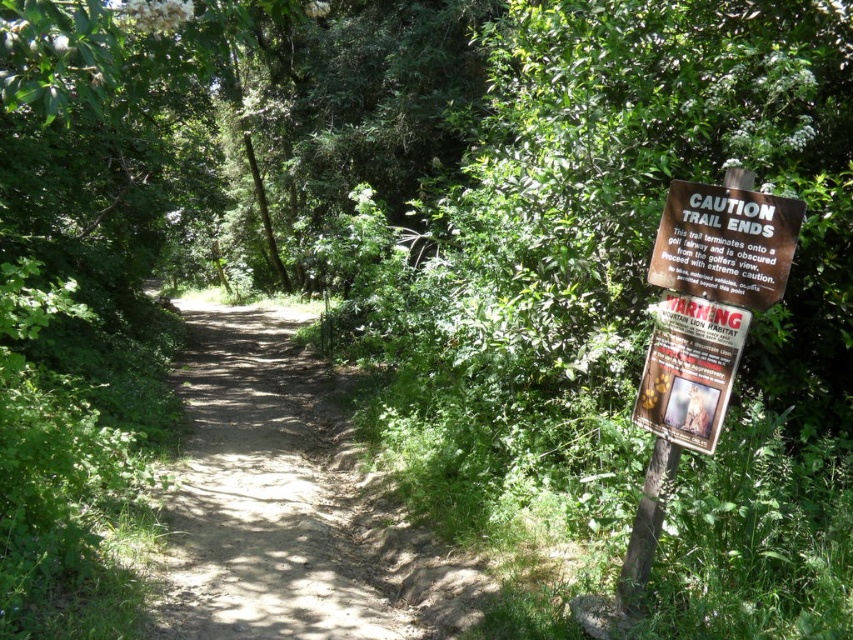
Question: Can you confirm if brown wooden sign at right is positioned above wooden sign at right?

Choices:
 (A) no
 (B) yes

Answer: (B)

Question: Which point is farther to the camera?

Choices:
 (A) wooden sign at right
 (B) brown wooden sign at right

Answer: (A)

Question: Which point is farther from the camera taking this photo?

Choices:
 (A) (722, 346)
 (B) (248, 358)
 (C) (738, 278)

Answer: (B)

Question: Does brown wooden sign at right have a larger size compared to wooden sign at right?

Choices:
 (A) yes
 (B) no

Answer: (A)

Question: Which point is farther to the camera?

Choices:
 (A) (181, 525)
 (B) (708, 412)
 (C) (788, 224)

Answer: (A)

Question: Is brown wooden sign at right above wooden sign at right?

Choices:
 (A) no
 (B) yes

Answer: (B)